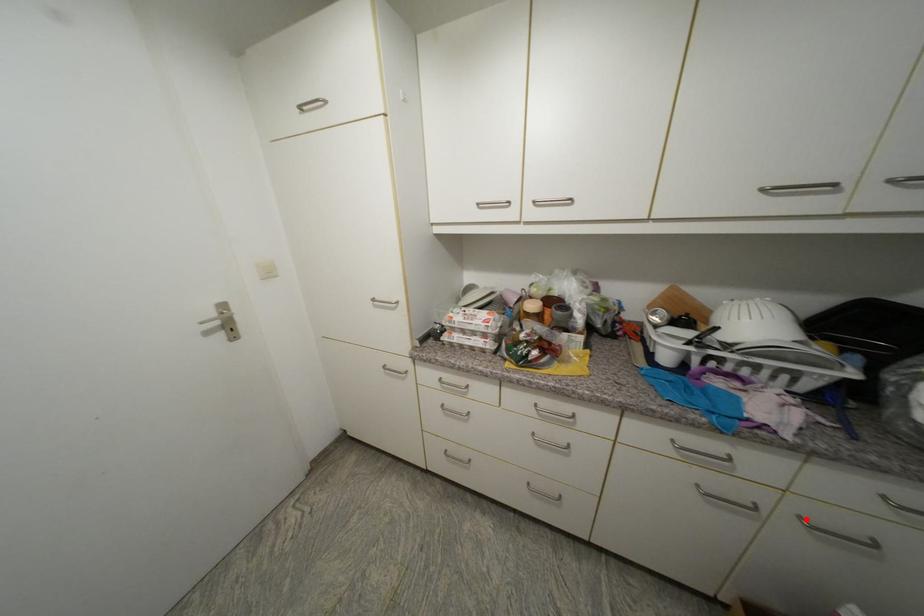
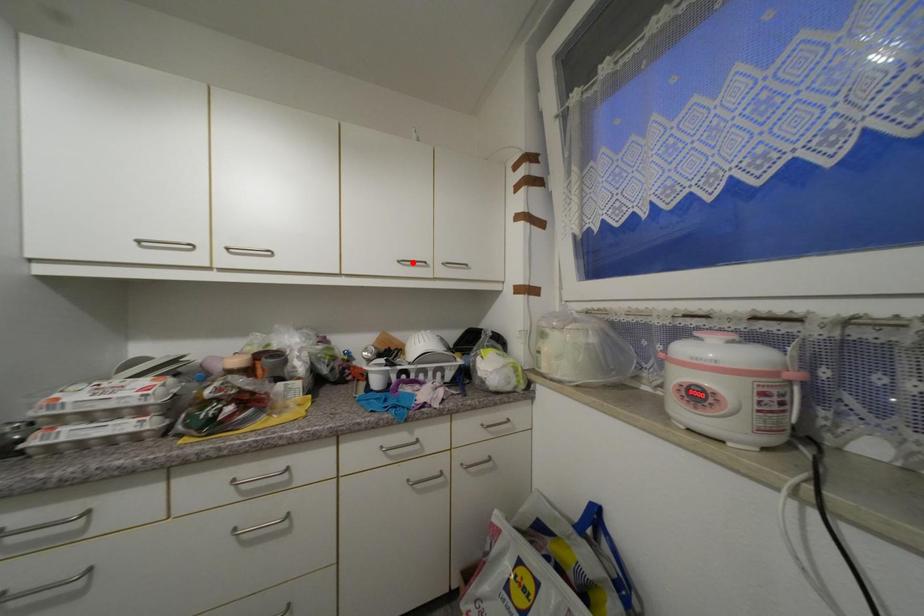
In the scene shown: I am providing you with two images of the same scene from different viewpoints. A red point is marked on the first image and another point is marked on the second image. Is the marked point in image1 the same physical position as the marked point in image2?

No